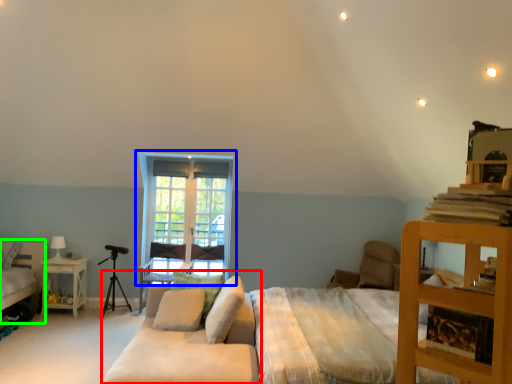
Question: Which object is the closest to the studio couch (highlighted by a red box)? Choose among these: window (highlighted by a blue box) or bed (highlighted by a green box).

Choices:
 (A) window
 (B) bed

Answer: (A)